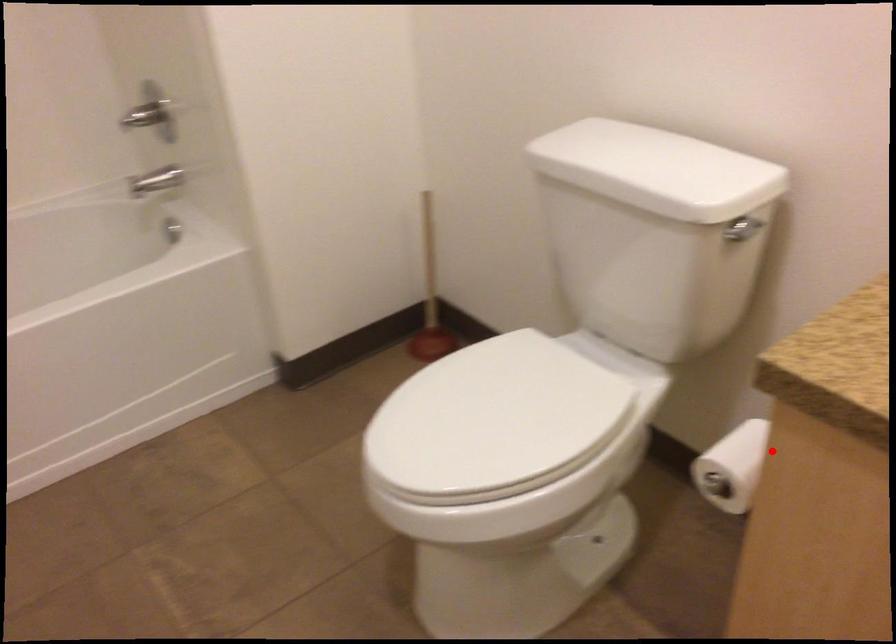
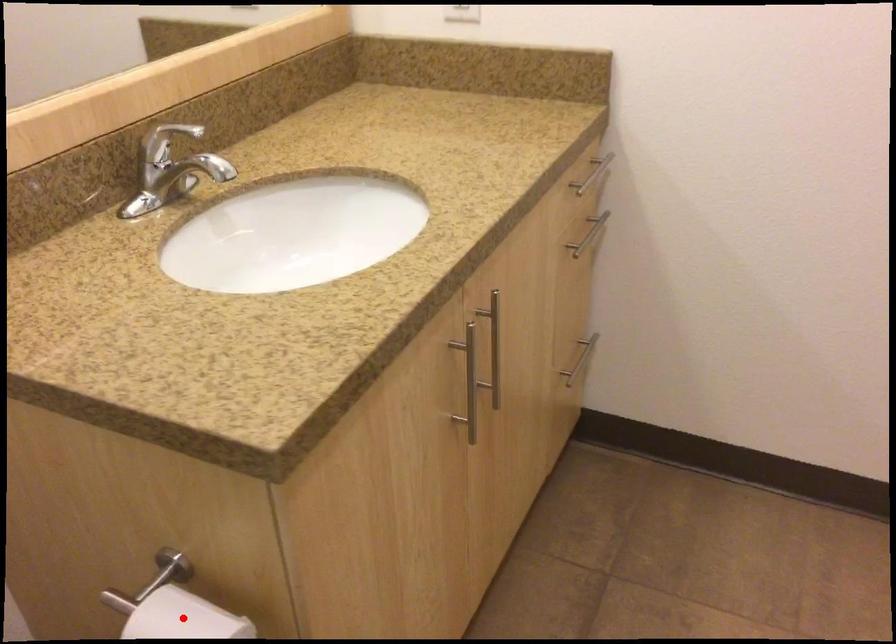
I am providing you with two images of the same scene from different viewpoints. A red point is marked on the first image and another point is marked on the second image. Does the point marked in image1 correspond to the same location as the one in image2?

Yes